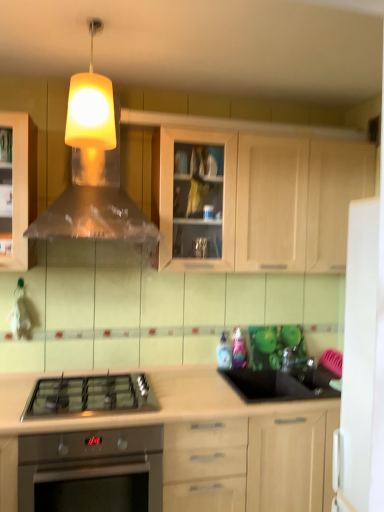
Question: Does stainless steel oven at lower left lie behind satin nickel faucet at right?

Choices:
 (A) no
 (B) yes

Answer: (A)

Question: From a real-world perspective, does stainless steel oven at lower left stand above satin nickel faucet at right?

Choices:
 (A) yes
 (B) no

Answer: (B)

Question: From the image's perspective, is stainless steel oven at lower left over satin nickel faucet at right?

Choices:
 (A) yes
 (B) no

Answer: (B)

Question: Is stainless steel oven at lower left closer to camera compared to satin nickel faucet at right?

Choices:
 (A) yes
 (B) no

Answer: (A)

Question: Does stainless steel oven at lower left have a lesser width compared to satin nickel faucet at right?

Choices:
 (A) no
 (B) yes

Answer: (A)

Question: Looking at their shapes, would you say light wood cabinet at upper center, marked as the 2th cabinetry in a bottom-to-top arrangement, is wider or thinner than light wood cabinet at center, acting as the second cabinetry starting from the top?

Choices:
 (A) wide
 (B) thin

Answer: (B)

Question: Would you say light wood cabinet at upper center, marked as the 2th cabinetry in a bottom-to-top arrangement, is inside or outside light wood cabinet at center, which is the first cabinetry from bottom to top?

Choices:
 (A) outside
 (B) inside

Answer: (A)

Question: In the image, is light wood cabinet at upper center, which is counted as the 1th cabinetry, starting from the top, positioned in front of or behind light wood cabinet at center, which is the first cabinetry from bottom to top?

Choices:
 (A) front
 (B) behind

Answer: (B)

Question: In the image, is light wood cabinet at upper center, marked as the 2th cabinetry in a bottom-to-top arrangement, on the left side or the right side of light wood cabinet at center, which is the first cabinetry from bottom to top?

Choices:
 (A) left
 (B) right

Answer: (B)

Question: Is point (271, 409) closer or farther from the camera than point (291, 351)?

Choices:
 (A) closer
 (B) farther

Answer: (A)

Question: Based on their sizes in the image, would you say light wood cabinet at center, acting as the second cabinetry starting from the top, is bigger or smaller than satin nickel faucet at right?

Choices:
 (A) small
 (B) big

Answer: (B)

Question: Based on their positions, is light wood cabinet at center, which is the first cabinetry from bottom to top, located to the left or right of satin nickel faucet at right?

Choices:
 (A) left
 (B) right

Answer: (A)

Question: From the image's perspective, relative to satin nickel faucet at right, is light wood cabinet at center, which is the first cabinetry from bottom to top, above or below?

Choices:
 (A) below
 (B) above

Answer: (A)

Question: Considering the positions of satin nickel faucet at right and metallic silver vent at upper center in the image, is satin nickel faucet at right taller or shorter than metallic silver vent at upper center?

Choices:
 (A) short
 (B) tall

Answer: (A)

Question: From the image's perspective, is satin nickel faucet at right located above or below metallic silver vent at upper center?

Choices:
 (A) below
 (B) above

Answer: (A)